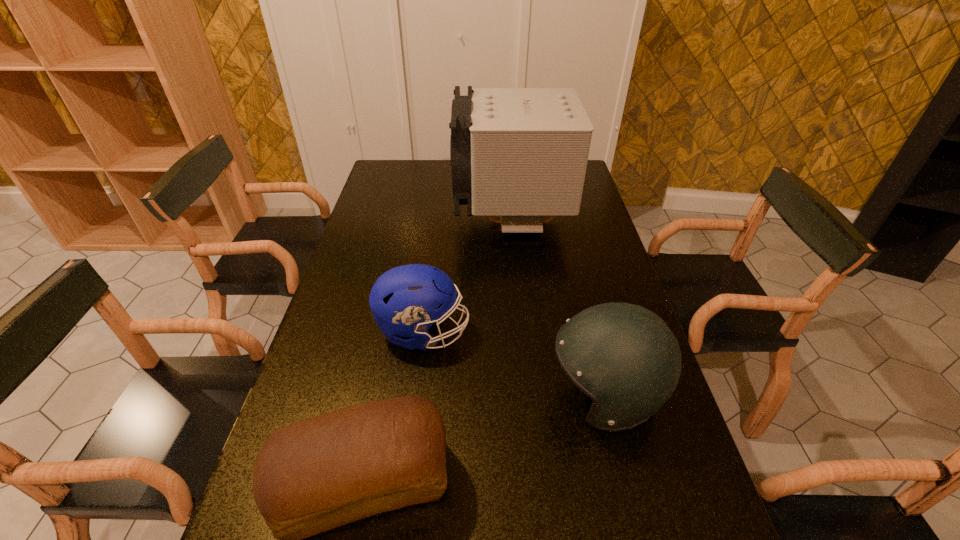
This screenshot has width=960, height=540. What are the coordinates of `the tallest object` in the screenshot? It's located at (521, 154).

I want to click on the farthest object, so pyautogui.click(x=521, y=154).

Find the location of a particular element. The width and height of the screenshot is (960, 540). the third shortest object is located at coordinates (624, 357).

At what (x,y) coordinates should I click in order to perform the action: click on the right football helmet. Please return your answer as a coordinate pair (x, y). This screenshot has height=540, width=960. Looking at the image, I should click on (624, 357).

The height and width of the screenshot is (540, 960). I want to click on the shorter football helmet, so click(407, 300).

Find the location of a particular element. This screenshot has width=960, height=540. free region located 0.370m on the front of the fan is located at coordinates [521, 333].

Locate an element on the screen. blank space located 0.180m at the face opening of the third shortest object is located at coordinates click(470, 395).

The image size is (960, 540). Find the location of `vacant area situated at the face opening of the third shortest object`. vacant area situated at the face opening of the third shortest object is located at coordinates (517, 395).

Where is `vacant position located at the face opening of the third shortest object`? Image resolution: width=960 pixels, height=540 pixels. vacant position located at the face opening of the third shortest object is located at coordinates (462, 395).

Image resolution: width=960 pixels, height=540 pixels. I want to click on free space located on the front-facing side of the left football helmet, so click(619, 332).